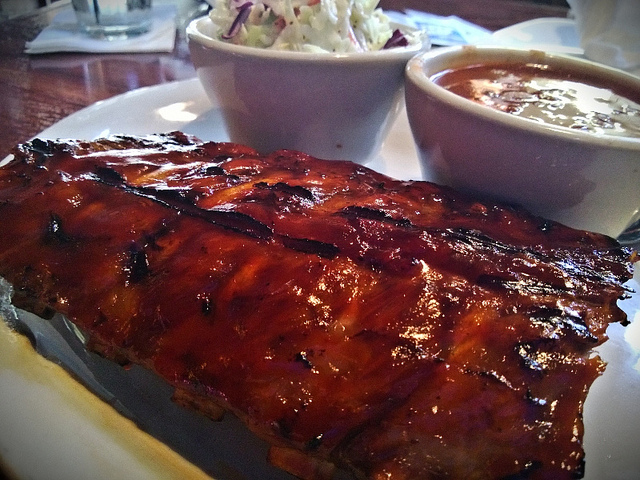
Find the location of a particular element. The image size is (640, 480). coleslaw inside ramekin is located at coordinates pyautogui.click(x=300, y=31).